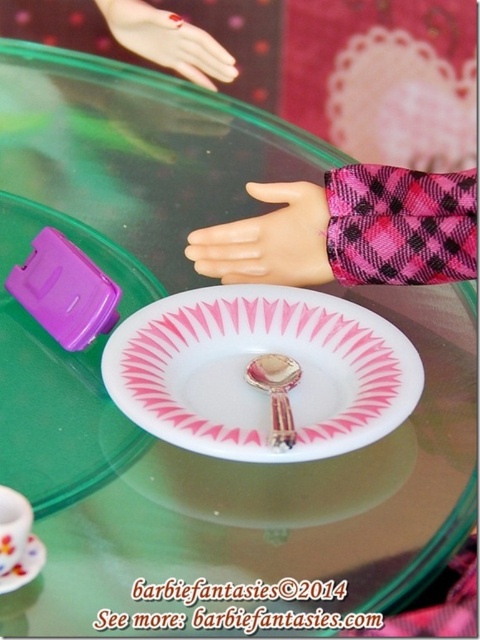
Question: Which of the following is the closest to the observer?

Choices:
 (A) (36, 294)
 (B) (181, 394)

Answer: (B)

Question: Does white glossy plate at lower center appear on the left side of pink matte hand at upper center?

Choices:
 (A) yes
 (B) no

Answer: (A)

Question: Can you confirm if purple plastic phone at left is positioned to the left of pink matte hand at upper center?

Choices:
 (A) no
 (B) yes

Answer: (B)

Question: Observing the image, what is the correct spatial positioning of white glossy paper plate at center in reference to white glossy plate at lower center?

Choices:
 (A) left
 (B) right

Answer: (B)

Question: Among these objects, which one is nearest to the camera?

Choices:
 (A) porcelain teacup at lower left
 (B) white glossy paper plate at center
 (C) white glossy saucer at lower left

Answer: (A)

Question: Which object appears closest to the camera in this image?

Choices:
 (A) white glossy saucer at lower left
 (B) porcelain teacup at lower left

Answer: (B)